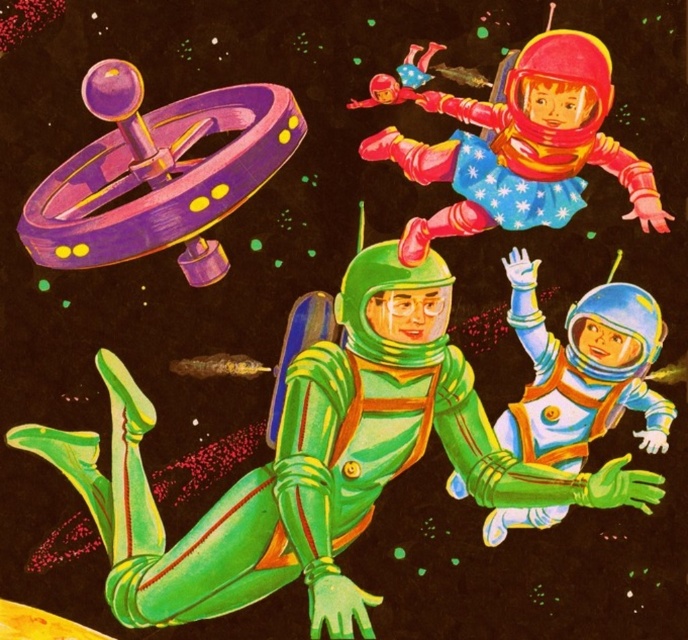
Is purple glossy spinner at upper left wider than shiny blue spacesuit at lower right?

No, purple glossy spinner at upper left is not wider than shiny blue spacesuit at lower right.

Who is more forward, (230,168) or (612,289)?

Point (230,168) is in front.

The width and height of the screenshot is (688, 640). I want to click on purple glossy spinner at upper left, so click(158, 173).

Is purple glossy spinner at upper left thinner than shiny plastic astronaut at upper center?

Indeed, purple glossy spinner at upper left has a lesser width compared to shiny plastic astronaut at upper center.

Find the location of a particular element. The width and height of the screenshot is (688, 640). purple glossy spinner at upper left is located at coordinates (158, 173).

In order to click on purple glossy spinner at upper left in this screenshot , I will do `click(158, 173)`.

Does shiny plastic astronaut at upper center appear under shiny blue spacesuit at lower right?

Actually, shiny plastic astronaut at upper center is above shiny blue spacesuit at lower right.

What do you see at coordinates (517, 145) in the screenshot? I see `shiny plastic astronaut at upper center` at bounding box center [517, 145].

Between point (376, 81) and point (508, 429), which one is positioned in front?

Point (508, 429) is more forward.

Identify the location of shiny plastic astronaut at upper center. The image size is (688, 640). (517, 145).